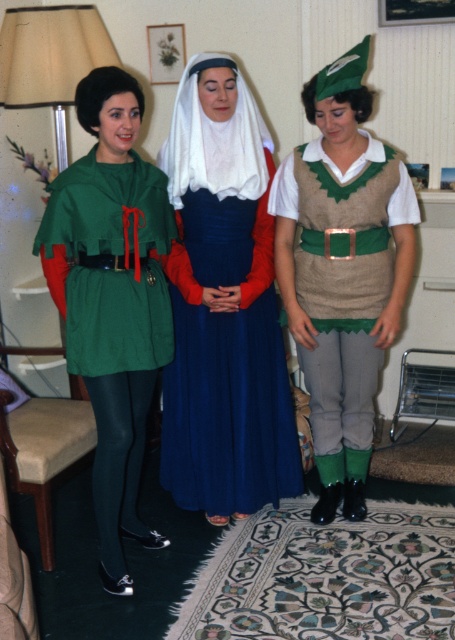
You are a photographer setting up a shoot in this living room. You need to arrange a spotlight so that it illuminates both the knitted beige vest at center and the green fabric cape at left. Since the spotlight can only focus on one area, which object should you place closer to the center of the spotlight to ensure both are lit adequately?

The knitted beige vest at center is positioned on the right side of green fabric cape at left. To ensure both are lit adequately, place the knitted beige vest at center closer to the center of the spotlight since it is already positioned to the right of the green fabric cape at left, balancing their positions under the spotlight.

You are a photographer setting up a shoot in this living room. You need to position a spotlight so that it illuminates both the blue satin dress at center and the green fabric cape at left without casting shadows on the wall. Considering their positions, which object should be placed closer to the spotlight to achieve this?

The blue satin dress at center should be placed closer to the spotlight because it is positioned above the green fabric cape at left, so moving it closer will help avoid shadows on the wall.

You are trying to place a decorative wreath on the wall directly behind the blue satin dress at center. According to the image, where should you position the wreath relative to the dress?

The blue satin dress at center is located at point [223,305], so you should place the wreath directly behind it at that coordinate.